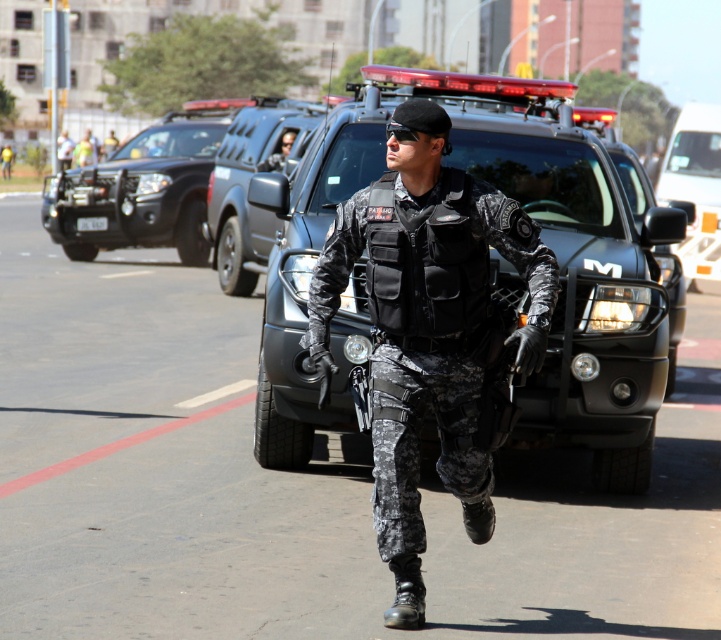
You are a pedestrian standing at point (247, 182). What object is directly in front of you?

The glossy black jeep at center is directly in front of you at point (247, 182).